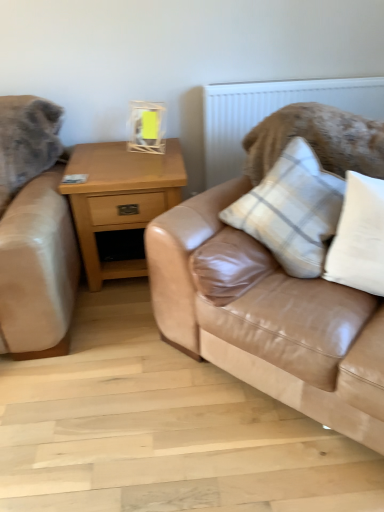
Question: Is plaid fabric pillow at center, which is counted as the 1th pillow, starting from the left, thinner than white textured radiator at upper center?

Choices:
 (A) yes
 (B) no

Answer: (B)

Question: Is plaid fabric pillow at center, arranged as the second pillow when viewed from the right, far from white textured radiator at upper center?

Choices:
 (A) no
 (B) yes

Answer: (A)

Question: From a real-world perspective, is plaid fabric pillow at center, arranged as the second pillow when viewed from the right, positioned under white textured radiator at upper center based on gravity?

Choices:
 (A) no
 (B) yes

Answer: (A)

Question: Is plaid fabric pillow at center, arranged as the second pillow when viewed from the right, oriented away from white textured radiator at upper center?

Choices:
 (A) no
 (B) yes

Answer: (B)

Question: Could you tell me if plaid fabric pillow at center, which is counted as the 1th pillow, starting from the left, is turned towards white textured radiator at upper center?

Choices:
 (A) yes
 (B) no

Answer: (B)

Question: Looking at their shapes, would you say white textured radiator at upper center is wider or thinner than white cotton pillow at upper right, which is the 1th pillow from right to left?

Choices:
 (A) wide
 (B) thin

Answer: (B)

Question: Is white textured radiator at upper center situated inside white cotton pillow at upper right, which is the 1th pillow from right to left, or outside?

Choices:
 (A) inside
 (B) outside

Answer: (B)

Question: From their relative heights in the image, would you say white textured radiator at upper center is taller or shorter than white cotton pillow at upper right, arranged as the 2th pillow when viewed from the left?

Choices:
 (A) tall
 (B) short

Answer: (A)

Question: In the image, is white textured radiator at upper center on the left side or the right side of white cotton pillow at upper right, which is the 1th pillow from right to left?

Choices:
 (A) left
 (B) right

Answer: (A)

Question: Is matte yellow glass at upper center in front of or behind tan leather couch at center in the image?

Choices:
 (A) behind
 (B) front

Answer: (A)

Question: From a real-world perspective, is matte yellow glass at upper center positioned above or below tan leather couch at center?

Choices:
 (A) below
 (B) above

Answer: (B)

Question: Is matte yellow glass at upper center taller or shorter than tan leather couch at center?

Choices:
 (A) tall
 (B) short

Answer: (B)

Question: In the image, is matte yellow glass at upper center on the left side or the right side of tan leather couch at center?

Choices:
 (A) left
 (B) right

Answer: (A)

Question: In terms of size, does tan leather couch at center appear bigger or smaller than light brown wood nightstand at center?

Choices:
 (A) small
 (B) big

Answer: (B)

Question: In terms of height, does tan leather couch at center look taller or shorter compared to light brown wood nightstand at center?

Choices:
 (A) short
 (B) tall

Answer: (B)